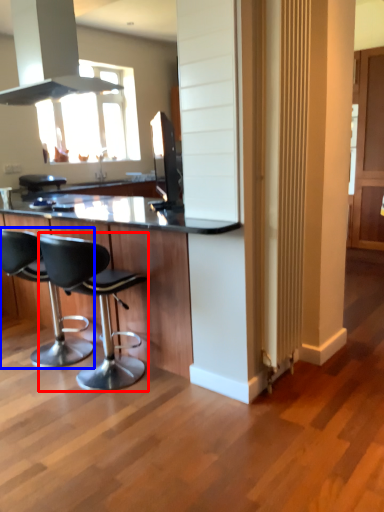
Question: Which object appears farthest to the camera in this image, chair (highlighted by a red box) or chair (highlighted by a blue box)?

Choices:
 (A) chair
 (B) chair

Answer: (B)